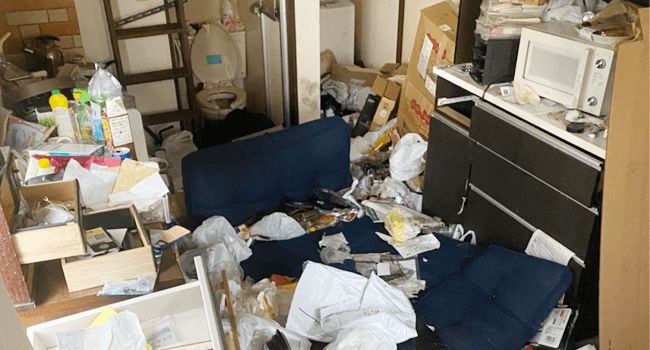
Find any where you would open the microwave in the picture. Your answer should be formatted as a list of tuples, i.e. [(x1, y1), (x2, y2), ...], where each tuple contains the x and y coordinates of a point satisfying the conditions above.

[(582, 74)]